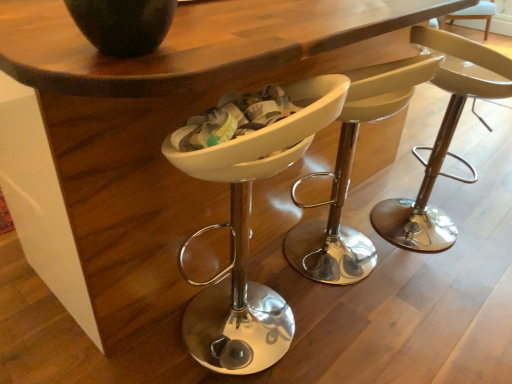
Question: Is white plastic chair at center, which appears as the first chair when viewed from the left, inside or outside of matte black vase at upper left?

Choices:
 (A) outside
 (B) inside

Answer: (A)

Question: Is white plastic chair at center, which appears as the first chair when viewed from the left, bigger or smaller than matte black vase at upper left?

Choices:
 (A) small
 (B) big

Answer: (B)

Question: Based on their relative distances, which object is farther from the white plastic chair at center, which ranks as the 3th chair in right-to-left order?

Choices:
 (A) matte beige stool at center, the third chair when ordered from left to right
 (B) white plastic chair at center, the 2th chair when ordered from right to left
 (C) matte black vase at upper left
 (D) matte white bar stool at center

Answer: (D)

Question: Estimate the real-world distances between objects in this image. Which object is farther from the matte beige stool at center, the third chair when ordered from left to right?

Choices:
 (A) white plastic chair at center, the 2th chair when ordered from right to left
 (B) white plastic chair at center, which ranks as the 3th chair in right-to-left order
 (C) matte black vase at upper left
 (D) matte white bar stool at center

Answer: (C)